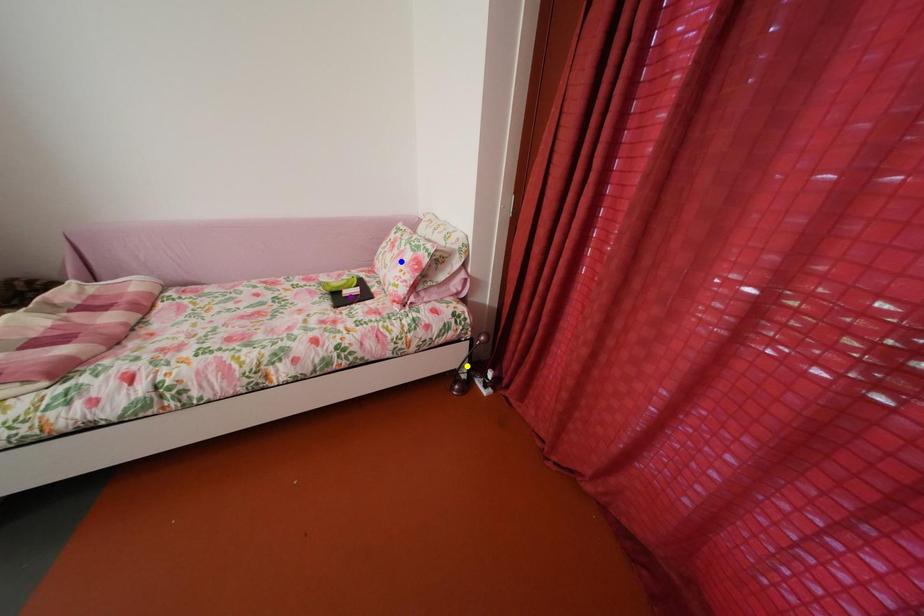
Order these from farthest to nearest:
yellow point, blue point, purple point

1. purple point
2. yellow point
3. blue point